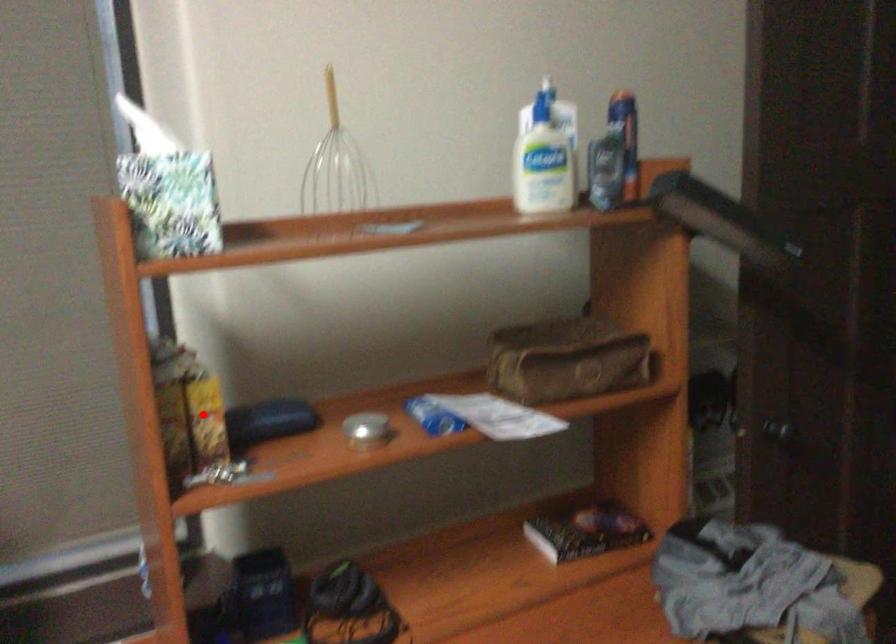
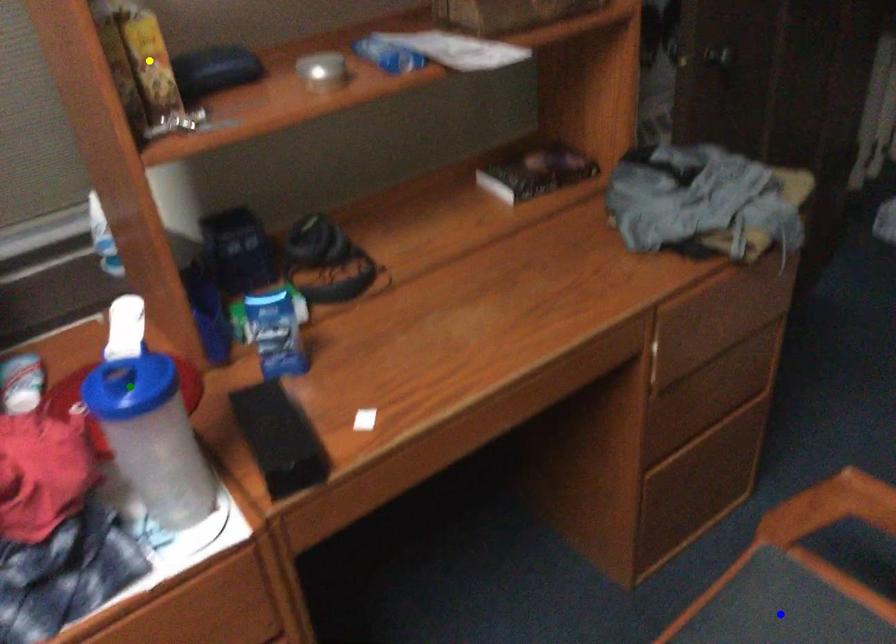
Question: I am providing you with two images of the same scene from different viewpoints. A red point is marked on the first image. You are given multiple points on the second image. Which mark in image 2 goes with the point in image 1?

Choices:
 (A) blue point
 (B) green point
 (C) yellow point

Answer: (C)